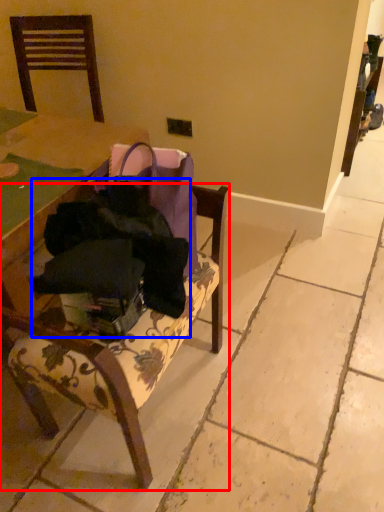
Question: Which object is closer to the camera taking this photo, chair (highlighted by a red box) or clothing (highlighted by a blue box)?

Choices:
 (A) chair
 (B) clothing

Answer: (A)